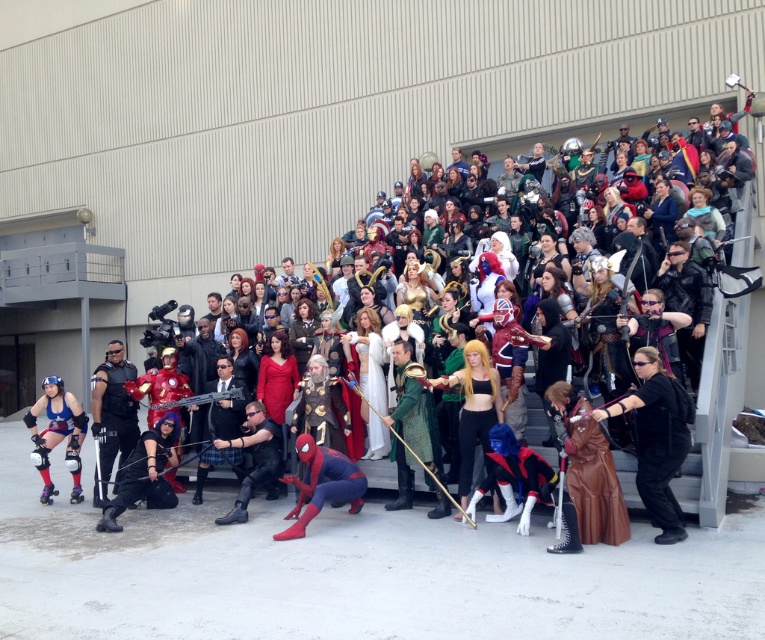
Between black matte vest at center and black leather jacket at center, which one appears on the right side from the viewer's perspective?

black leather jacket at center is more to the right.

Is black matte vest at center to the left of black leather jacket at center from the viewer's perspective?

Yes, black matte vest at center is to the left of black leather jacket at center.

Measure the distance between point (129, 420) and camera.

41.34 feet

Where is `black matte vest at center`? This screenshot has width=765, height=640. black matte vest at center is located at coordinates (111, 417).

Can you confirm if black leather jacket at lower right is taller than leather black vest at center?

Indeed, black leather jacket at lower right has a greater height compared to leather black vest at center.

Image resolution: width=765 pixels, height=640 pixels. What do you see at coordinates (656, 442) in the screenshot?
I see `black leather jacket at lower right` at bounding box center [656, 442].

Between point (597, 413) and point (243, 444), which one is positioned in front?

Positioned in front is point (597, 413).

Find the location of `black leather jacket at lower right`. black leather jacket at lower right is located at coordinates (656, 442).

Does shiny silver sword at center appear over matte blue and purple roller skates at lower left?

Correct, shiny silver sword at center is located above matte blue and purple roller skates at lower left.

Is point (747, 220) less distant than point (57, 387)?

No.

Is point (724, 406) less distant than point (57, 381)?

Yes, point (724, 406) is in front of point (57, 381).

What are the coordinates of `shiny silver sword at center` in the screenshot? It's located at (721, 385).